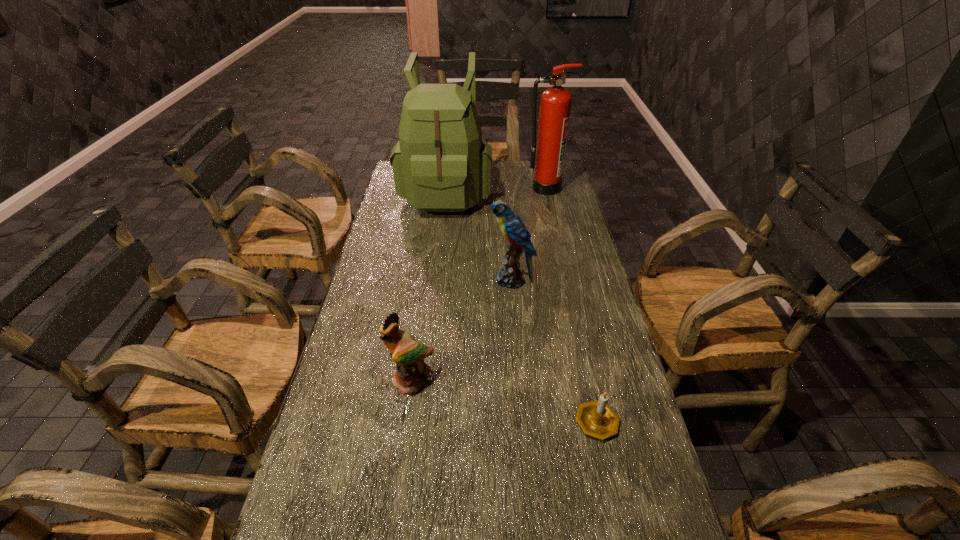
I want to click on free space located 0.200m on the face of the farther parrot, so click(x=429, y=280).

Identify the location of free location located on the face of the farther parrot. The width and height of the screenshot is (960, 540). (386, 280).

Image resolution: width=960 pixels, height=540 pixels. What are the coordinates of `blank space located on the face of the farther parrot` in the screenshot? It's located at (457, 280).

You are a GUI agent. You are given a task and a screenshot of the screen. Output one action in this format:
    pyautogui.click(x=<x>, y=<y>)
    Task: Click on the vacant space positioned 0.220m on the front-facing side of the nearer parrot
    This screenshot has height=540, width=960.
    Given the screenshot: What is the action you would take?
    pyautogui.click(x=396, y=487)

At what (x,y) coordinates should I click in order to perform the action: click on free location located 0.280m on the left of the nearest object. Please return your answer as a coordinate pair (x, y). Looking at the image, I should click on (457, 420).

The height and width of the screenshot is (540, 960). I want to click on fire extinguisher that is positioned at the far edge, so click(548, 158).

What are the coordinates of `backpack that is at the far edge` in the screenshot? It's located at (440, 164).

The width and height of the screenshot is (960, 540). Identify the location of backpack that is at the left edge. [440, 164].

Find the location of a particular element. The image size is (960, 540). parrot situated at the left edge is located at coordinates (410, 373).

Identify the location of fire extinguisher that is at the right edge. (548, 158).